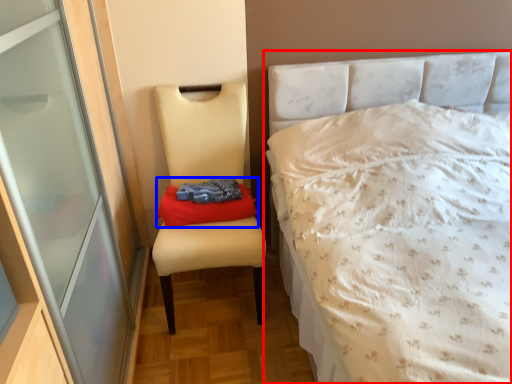
Question: Which point is closer to the camera, bed (highlighted by a red box) or material (highlighted by a blue box)?

Choices:
 (A) bed
 (B) material

Answer: (A)